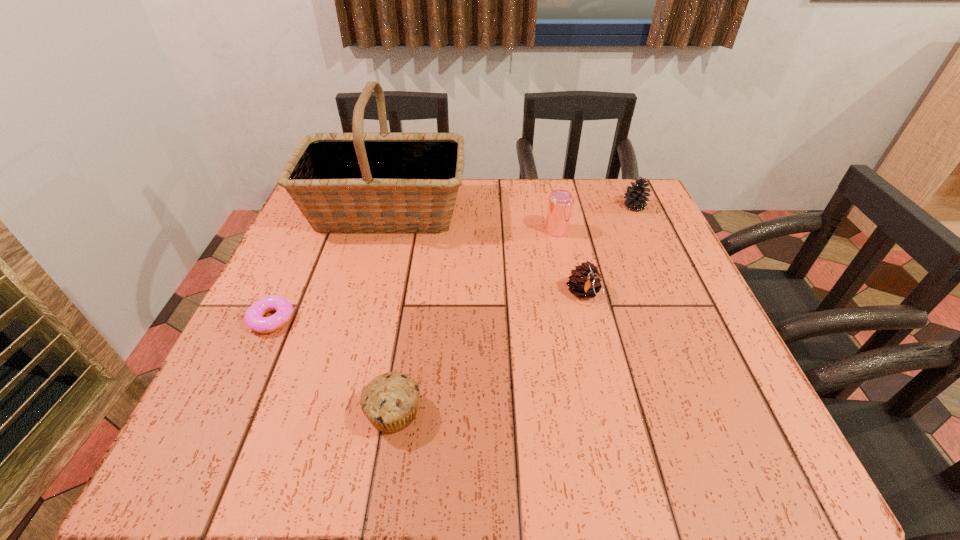
This screenshot has height=540, width=960. I want to click on object that is at the far left corner, so click(343, 183).

The image size is (960, 540). I want to click on object that is at the far right corner, so click(635, 197).

Where is `vacant space at the far edge of the desktop`? vacant space at the far edge of the desktop is located at coordinates [x=578, y=221].

At what (x,y) coordinates should I click in order to perform the action: click on blank area at the near edge. Please return your answer as a coordinate pair (x, y). Looking at the image, I should click on (599, 433).

Where is `vacant space at the left edge of the desktop`? Image resolution: width=960 pixels, height=540 pixels. vacant space at the left edge of the desktop is located at coordinates (300, 289).

This screenshot has height=540, width=960. Find the location of `vacant space at the right edge of the desktop`. vacant space at the right edge of the desktop is located at coordinates (647, 336).

Identify the location of vacant space at the far right corner. click(x=659, y=214).

You are a GUI agent. You are given a task and a screenshot of the screen. Output one action in this format:
    pyautogui.click(x=<x>, y=<y>)
    Task: Click on the free space between the nearer pinecone and the muffin
    
    Given the screenshot: What is the action you would take?
    pyautogui.click(x=489, y=353)

The image size is (960, 540). I want to click on free space between the tallest object and the doughnut, so click(329, 265).

Identify the location of empty location between the muffin and the tallest object. This screenshot has height=540, width=960. (390, 312).